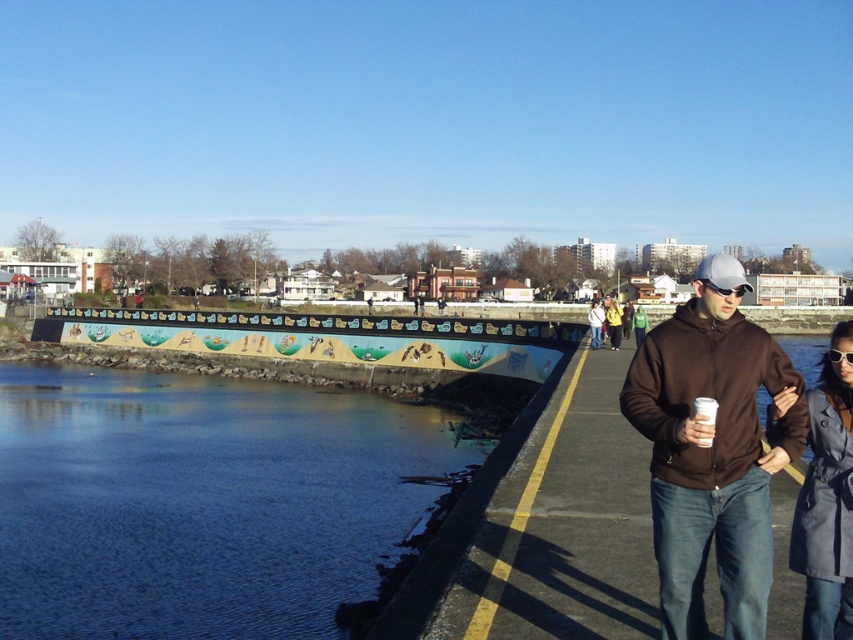
Question: Among these points, which one is farthest from the camera?

Choices:
 (A) (782, 401)
 (B) (749, 285)
 (C) (595, 300)

Answer: (C)

Question: Among these objects, which one is farthest from the camera?

Choices:
 (A) silver reflective goggles at center
 (B) dark gray coat at right

Answer: (B)

Question: Which point is farther to the camera?

Choices:
 (A) (695, 458)
 (B) (61, 609)

Answer: (B)

Question: Is blue water at lower left above brown matte jacket at center?

Choices:
 (A) no
 (B) yes

Answer: (A)

Question: Does blue water at lower left have a greater width compared to brown matte jacket at center-right?

Choices:
 (A) yes
 (B) no

Answer: (B)

Question: Does blue water at lower left have a larger size compared to brown matte jacket at center-right?

Choices:
 (A) yes
 (B) no

Answer: (B)